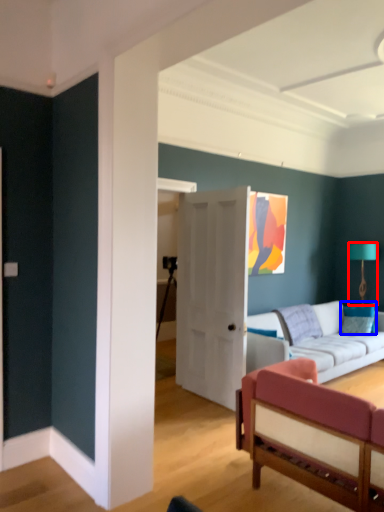
Question: Which point is closer to the camera, lamp (highlighted by a red box) or pillow (highlighted by a blue box)?

Choices:
 (A) lamp
 (B) pillow

Answer: (B)